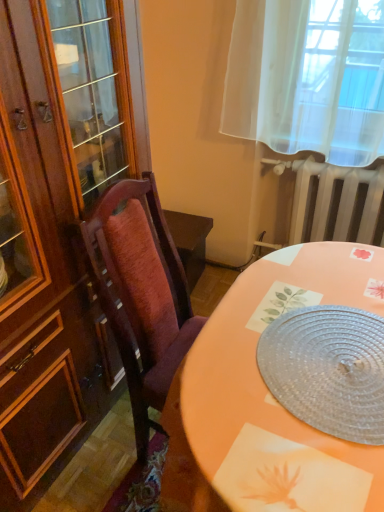
Question: Could you tell me if white metallic radiator at upper right is facing clear plastic placemat at center?

Choices:
 (A) no
 (B) yes

Answer: (B)

Question: Is the surface of white metallic radiator at upper right in direct contact with clear plastic placemat at center?

Choices:
 (A) no
 (B) yes

Answer: (A)

Question: Does white metallic radiator at upper right have a lesser width compared to clear plastic placemat at center?

Choices:
 (A) yes
 (B) no

Answer: (A)

Question: Can you confirm if white metallic radiator at upper right is smaller than clear plastic placemat at center?

Choices:
 (A) yes
 (B) no

Answer: (B)

Question: Is white metallic radiator at upper right taller than clear plastic placemat at center?

Choices:
 (A) yes
 (B) no

Answer: (A)

Question: Does white metallic radiator at upper right have a larger size compared to clear plastic placemat at center?

Choices:
 (A) yes
 (B) no

Answer: (A)

Question: Can you confirm if clear plastic placemat at center is wider than white metallic radiator at upper right?

Choices:
 (A) yes
 (B) no

Answer: (A)

Question: Does clear plastic placemat at center come in front of white metallic radiator at upper right?

Choices:
 (A) yes
 (B) no

Answer: (A)

Question: Is clear plastic placemat at center thinner than white metallic radiator at upper right?

Choices:
 (A) no
 (B) yes

Answer: (A)

Question: From a real-world perspective, does clear plastic placemat at center sit lower than white metallic radiator at upper right?

Choices:
 (A) yes
 (B) no

Answer: (B)

Question: Does clear plastic placemat at center lie behind white metallic radiator at upper right?

Choices:
 (A) yes
 (B) no

Answer: (B)

Question: Would you say white metallic radiator at upper right is part of clear plastic placemat at center's contents?

Choices:
 (A) yes
 (B) no

Answer: (B)

Question: Based on their positions, is clear plastic placemat at center located to the left or right of white metallic radiator at upper right?

Choices:
 (A) left
 (B) right

Answer: (A)